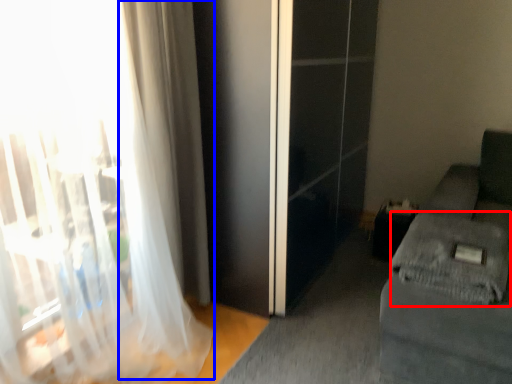
Question: Which object is closer to the camera taking this photo, sheet (highlighted by a red box) or curtain (highlighted by a blue box)?

Choices:
 (A) sheet
 (B) curtain

Answer: (A)